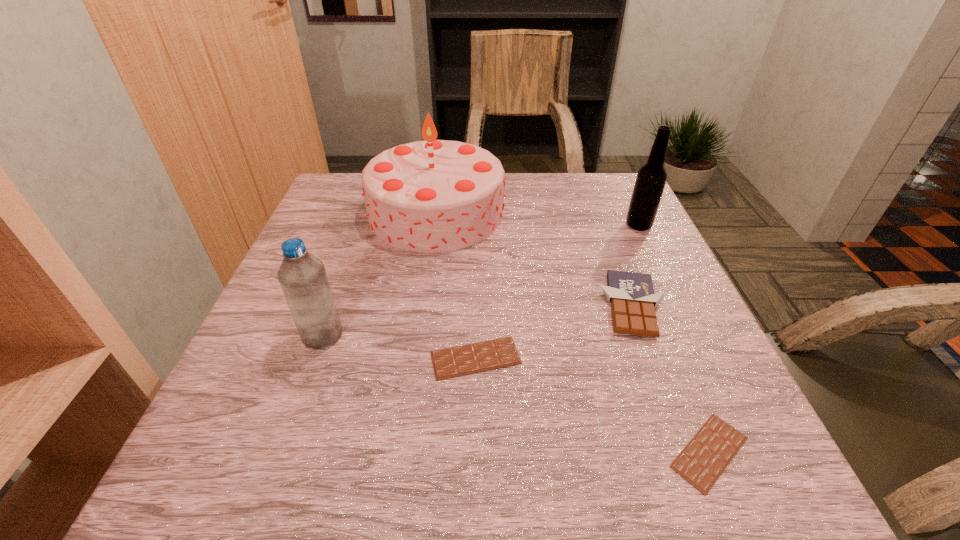
This screenshot has width=960, height=540. Find the location of `the closest chocolate bar to the nearest object`. the closest chocolate bar to the nearest object is located at coordinates (633, 300).

Identify the location of free location that satisfies the following two spatial constraints: 1. on the back side of the fourth shortest object; 2. on the left side of the fourth tallest object. (333, 306).

Image resolution: width=960 pixels, height=540 pixels. I want to click on free space that satisfies the following two spatial constraints: 1. on the back side of the beer bottle; 2. on the right side of the fourth tallest object, so click(x=603, y=225).

Where is `vacant space that satisfies the following two spatial constraints: 1. on the back side of the beer bottle; 2. on the left side of the third tallest object`? Image resolution: width=960 pixels, height=540 pixels. vacant space that satisfies the following two spatial constraints: 1. on the back side of the beer bottle; 2. on the left side of the third tallest object is located at coordinates (362, 225).

The height and width of the screenshot is (540, 960). I want to click on free spot that satisfies the following two spatial constraints: 1. on the front side of the birthday cake; 2. on the left side of the beer bottle, so click(x=435, y=225).